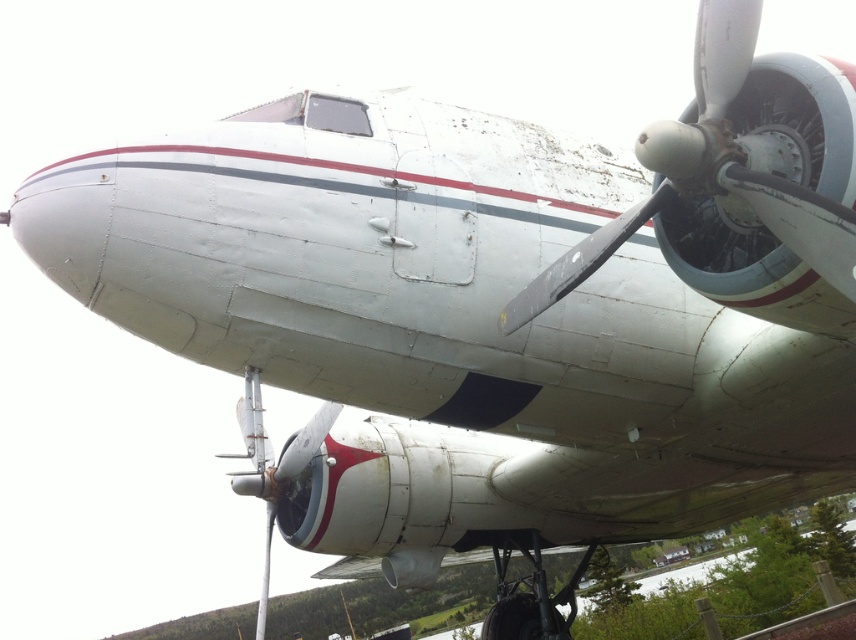
Question: Where is white matte propeller at center located in relation to silver metallic propeller at center in the image?

Choices:
 (A) right
 (B) left

Answer: (A)

Question: Is white matte propeller at center below silver metallic propeller at center?

Choices:
 (A) yes
 (B) no

Answer: (B)

Question: Which of the following is the farthest from the observer?

Choices:
 (A) silver metallic propeller at center
 (B) white matte propeller at center

Answer: (A)

Question: Observing the image, what is the correct spatial positioning of white matte propeller at center in reference to silver metallic propeller at center?

Choices:
 (A) left
 (B) right

Answer: (B)

Question: Which of the following is the closest to the observer?

Choices:
 (A) (263, 467)
 (B) (829, 278)

Answer: (B)